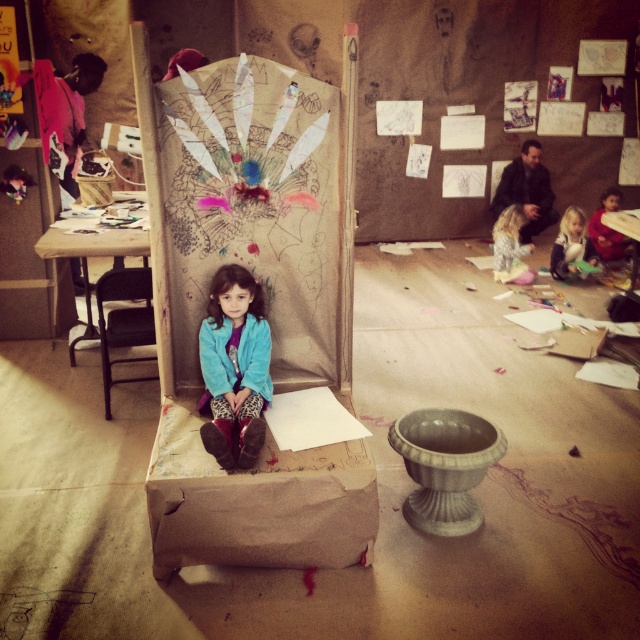
You are a teacher in the classroom and want to place a new poster on the wall. The cardboard bulletin board at center is located at point (x=250, y=209). Where should you place the poster to ensure it is centered exactly on the cardboard bulletin board at center?

The cardboard bulletin board at center is located at point (x=250, y=209), so placing the poster at those coordinates will center it exactly on the cardboard bulletin board at center.